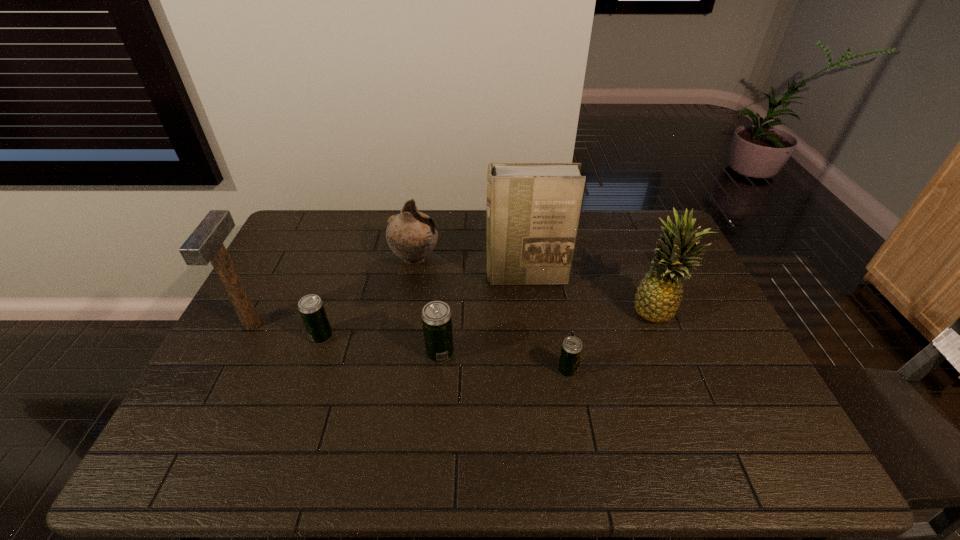
The width and height of the screenshot is (960, 540). I want to click on the second object from left to right, so click(311, 308).

At what (x,y) coordinates should I click in order to perform the action: click on the second shortest beer can. Please return your answer as a coordinate pair (x, y). Looking at the image, I should click on (311, 308).

The height and width of the screenshot is (540, 960). In order to click on the tallest beer can in this screenshot , I will do pyautogui.click(x=436, y=316).

Find the location of `the fifth tallest object`. the fifth tallest object is located at coordinates (436, 316).

You are a GUI agent. You are given a task and a screenshot of the screen. Output one action in this format:
    pyautogui.click(x=<x>, y=<y>)
    Task: Click on the rightmost beer can
    Image resolution: width=960 pixels, height=540 pixels.
    Given the screenshot: What is the action you would take?
    pyautogui.click(x=571, y=349)

This screenshot has height=540, width=960. Find the location of `the shortest beer can`. the shortest beer can is located at coordinates (571, 349).

Where is `phonebook`? This screenshot has width=960, height=540. phonebook is located at coordinates (533, 209).

This screenshot has height=540, width=960. In order to click on pineapple in this screenshot , I will do `click(658, 296)`.

Where is `the leftmost object`? The image size is (960, 540). the leftmost object is located at coordinates (205, 244).

Find the location of a particular element. The height and width of the screenshot is (540, 960). the fourth shortest object is located at coordinates (412, 235).